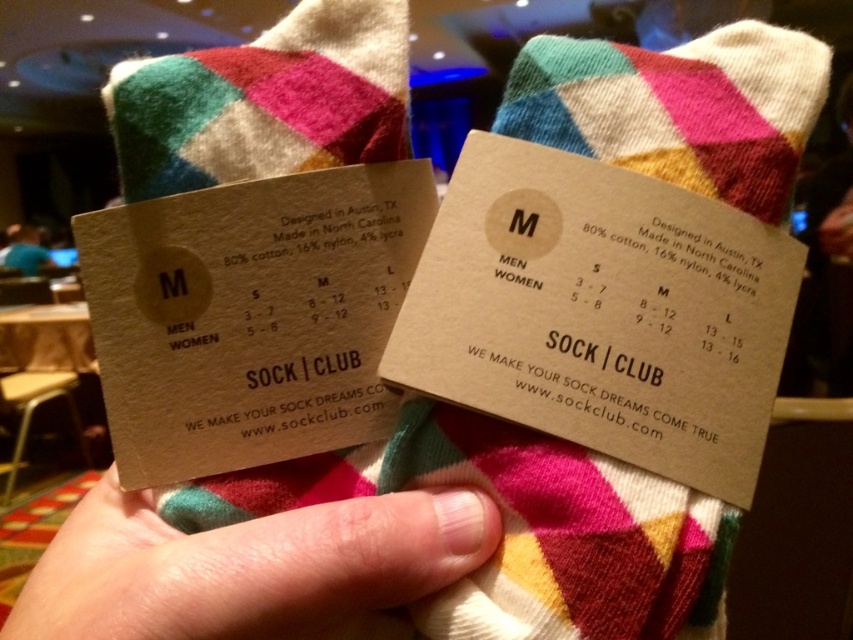
How much distance is there between pink skin at center and blue fabric shirt at upper left?

1.29 meters

Does point (486, 531) come farther from viewer compared to point (33, 262)?

That is False.

Is point (450, 509) farther from camera compared to point (32, 260)?

No, it is not.

Locate an element on the screen. pink skin at center is located at coordinates (250, 568).

Which is behind, point (312, 609) or point (386, 80)?

The point (386, 80) is behind.

Can you confirm if pink skin at center is thinner than multicolored woolen socks at center?

In fact, pink skin at center might be wider than multicolored woolen socks at center.

Between point (76, 544) and point (218, 164), which one is positioned in front?

Point (76, 544)

Where is `pink skin at center`? This screenshot has height=640, width=853. pink skin at center is located at coordinates tap(250, 568).

Can you confirm if multicolored woolen socks at center is positioned above blue fabric shirt at upper left?

Yes, multicolored woolen socks at center is above blue fabric shirt at upper left.

The width and height of the screenshot is (853, 640). Find the location of `multicolored woolen socks at center`. multicolored woolen socks at center is located at coordinates (265, 100).